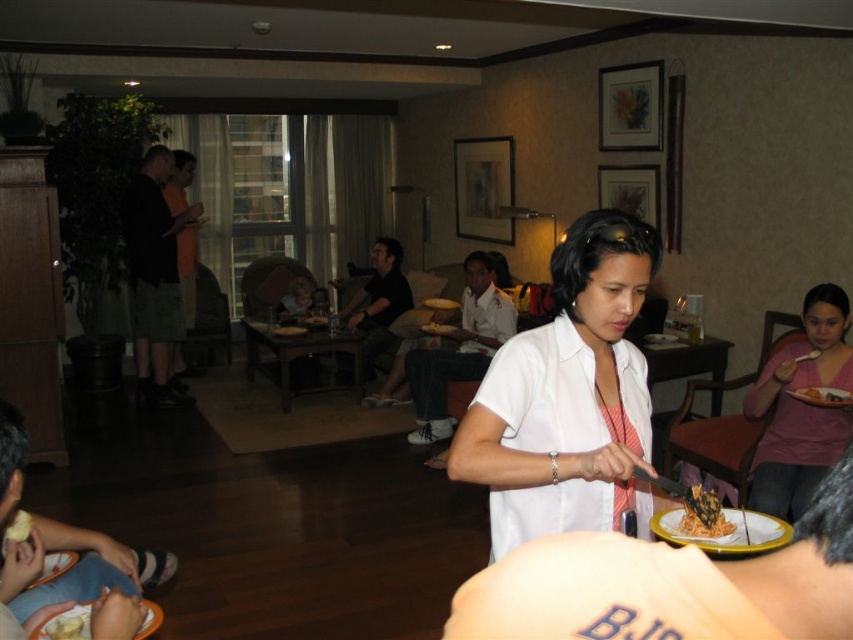
Between point (525, 500) and point (834, 346), which one is positioned behind?

Point (834, 346)

Can you confirm if white matte shirt at center is positioned below pink matte shirt at lower right?

No.

This screenshot has width=853, height=640. What are the coordinates of `white matte shirt at center` in the screenshot? It's located at (567, 396).

Identify the location of white matte shirt at center. (567, 396).

What do you see at coordinates (724, 532) in the screenshot? I see `white glossy plate at center` at bounding box center [724, 532].

Where is `white glossy plate at center`? The height and width of the screenshot is (640, 853). white glossy plate at center is located at coordinates (724, 532).

Which is in front, point (672, 518) or point (831, 401)?

Point (672, 518) is more forward.

Does white glossy plate at center appear on the right side of white matte plate at right?

Incorrect, white glossy plate at center is not on the right side of white matte plate at right.

You are a GUI agent. You are given a task and a screenshot of the screen. Output one action in this format:
    pyautogui.click(x=<x>, y=<y>)
    Task: Click on the white glossy plate at center
    
    Given the screenshot: What is the action you would take?
    pyautogui.click(x=724, y=532)